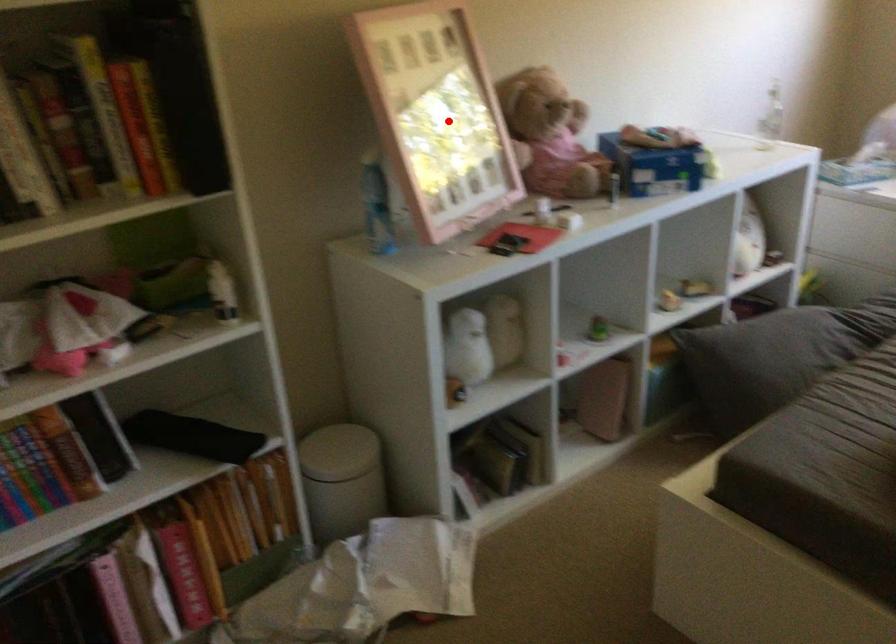
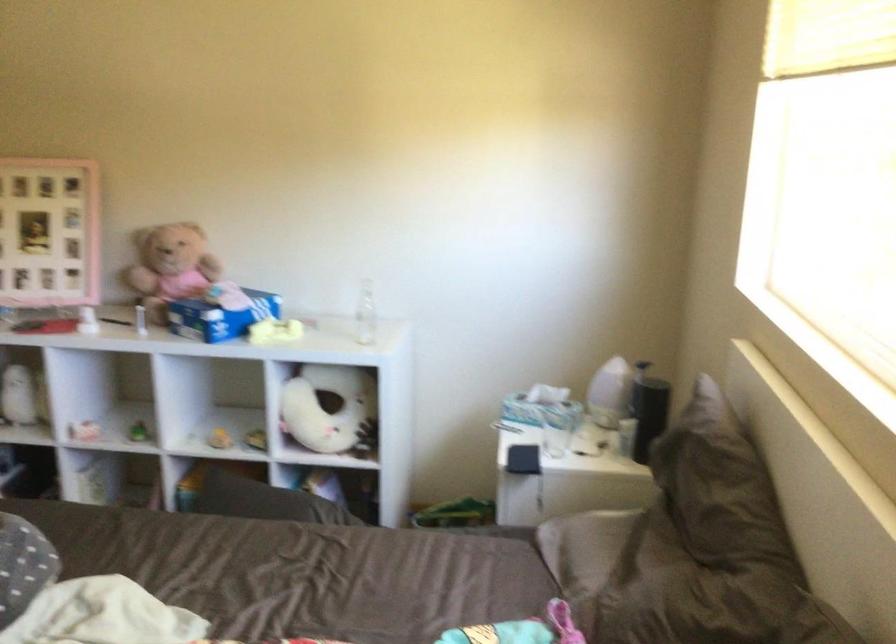
In the second image, find the point that corresponds to the highlighted location in the first image.

(48, 232)